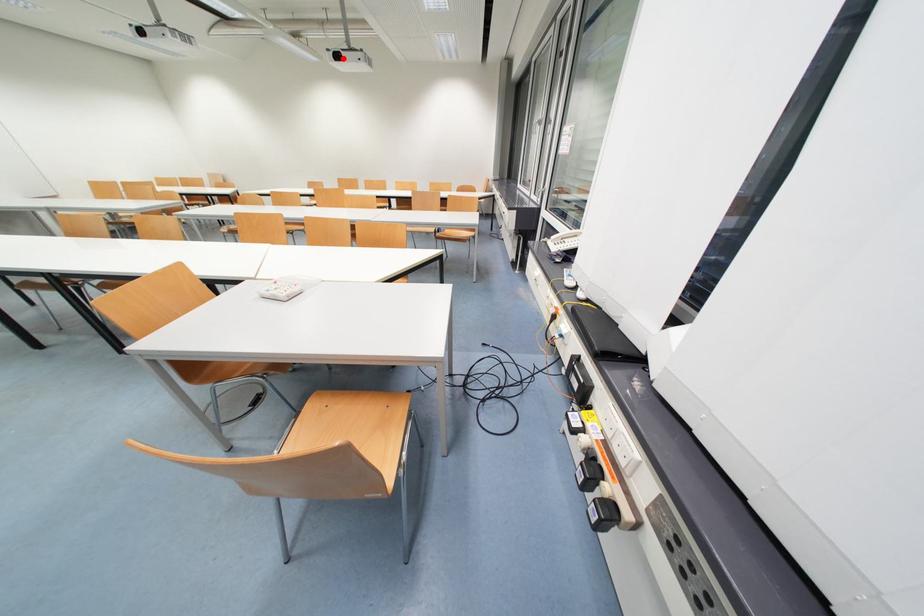
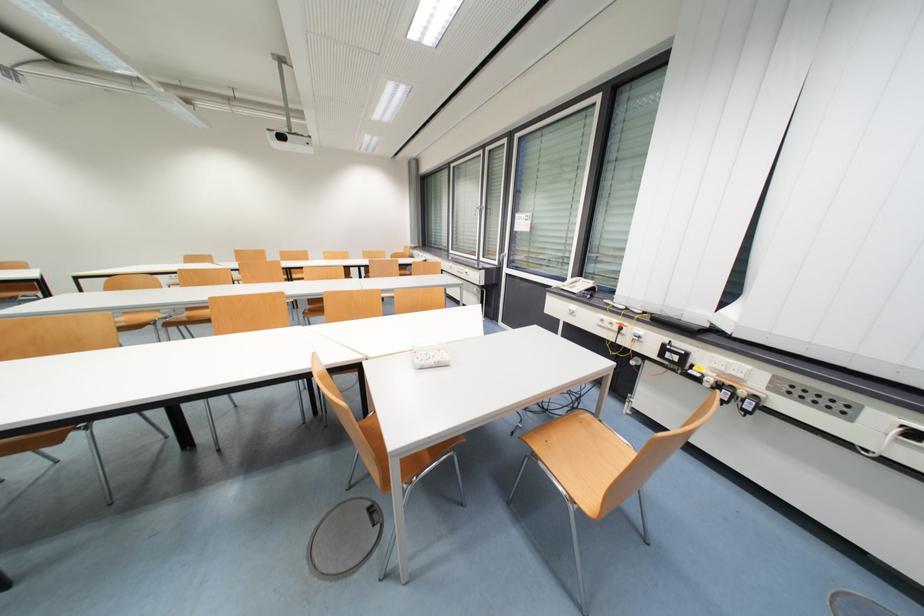
In the second image, find the point that corresponds to the highlighted location in the first image.

(286, 139)